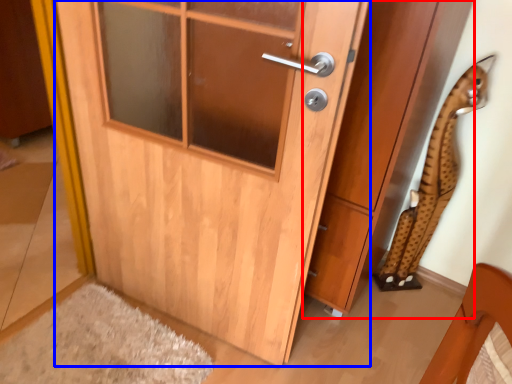
Question: Which point is further to the camera, cabinetry (highlighted by a red box) or door (highlighted by a blue box)?

Choices:
 (A) cabinetry
 (B) door

Answer: (A)